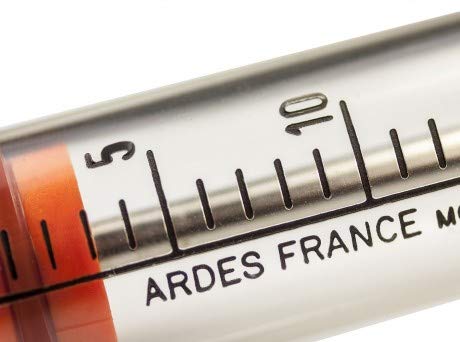
The image size is (460, 342). In order to click on light red plunger section in this screenshot , I will do `click(39, 187)`.